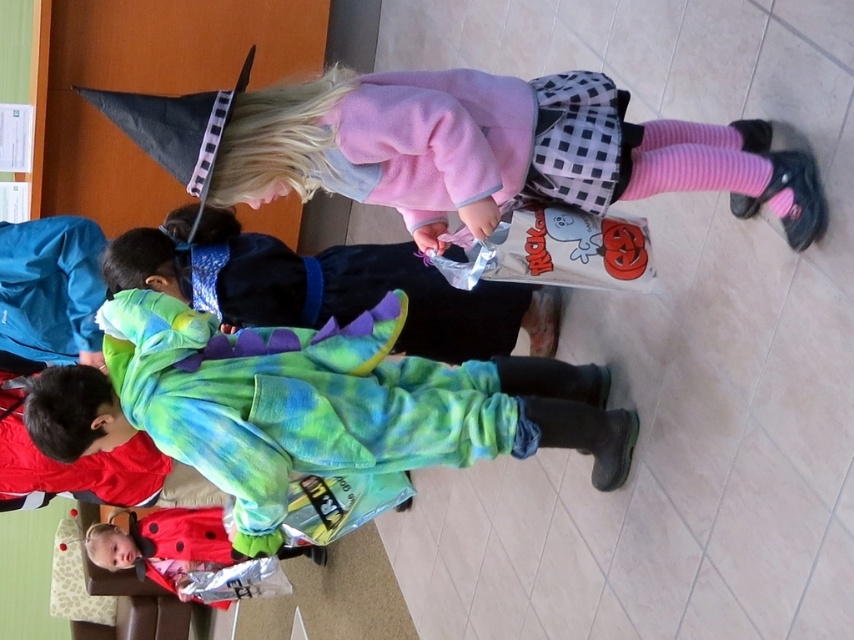
You are a parent trying to dress your child for a Halloween party. You have a fluffy green costume at center and a pink fleece sweater at upper center. Which item should you put on first according to their current positions in the image?

The fluffy green costume at center is positioned under the pink fleece sweater at upper center, so you should put on the pink fleece sweater at upper center first before the fluffy green costume at center.

You are a photographer standing at the entrance of the room. You need to position yourself so that you can capture both the fluffy green costume at center and the Halloween bag in the childs hand in the same frame. Based on their positions, which object is closer to the camera?

The fluffy green costume at center is closer to the camera because it is located at point [313,404] which is closer to the camera position at the entrance compared to the Halloween bag in the childs hand.

You are a photographer trying to capture a clear shot of both the fluffy green costume at center and the pink fleece sweater at upper center. Which object should you focus on first to ensure it appears sharp in the photo?

You should focus on the fluffy green costume at center first because it is closer to the viewer than the pink fleece sweater at upper center, so focusing on the closer object will keep it sharp while the background may blur slightly.